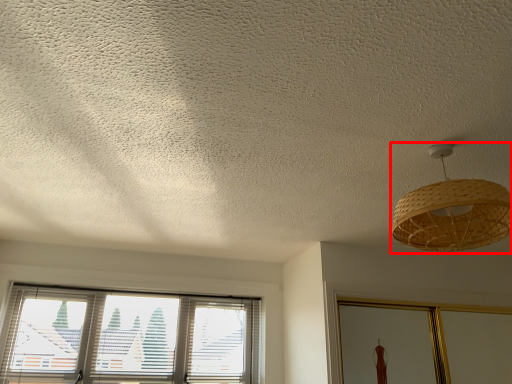
Question: From the image's perspective, where is lamp (annotated by the red box) located relative to window?

Choices:
 (A) above
 (B) below

Answer: (A)